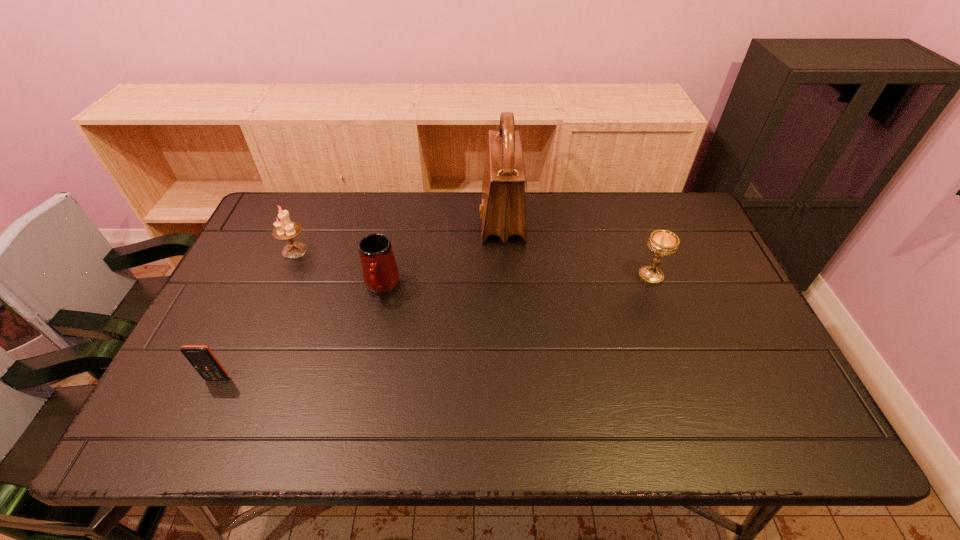
Image resolution: width=960 pixels, height=540 pixels. Identify the location of shoulder bag. (503, 211).

The image size is (960, 540). What are the coordinates of `the fourth object from left to right` in the screenshot? It's located at (503, 211).

This screenshot has height=540, width=960. Find the location of `candle holder`. candle holder is located at coordinates (285, 230).

Where is `the third object from right to left`? the third object from right to left is located at coordinates (380, 273).

Identify the location of chalice. This screenshot has height=540, width=960. (662, 243).

Find the location of a particular element. The height and width of the screenshot is (540, 960). cellular telephone is located at coordinates (201, 357).

This screenshot has height=540, width=960. I want to click on vacant space located 0.160m on the front flap of the fourth object from left to right, so click(431, 219).

Where is `blank space located 0.070m on the front flap of the fourth object from left to right`? blank space located 0.070m on the front flap of the fourth object from left to right is located at coordinates (458, 219).

In order to click on free space located on the front flap of the fourth object from left to right in this screenshot , I will do `click(367, 219)`.

Identify the location of vacant space positioned 0.190m on the right of the candle holder. (371, 250).